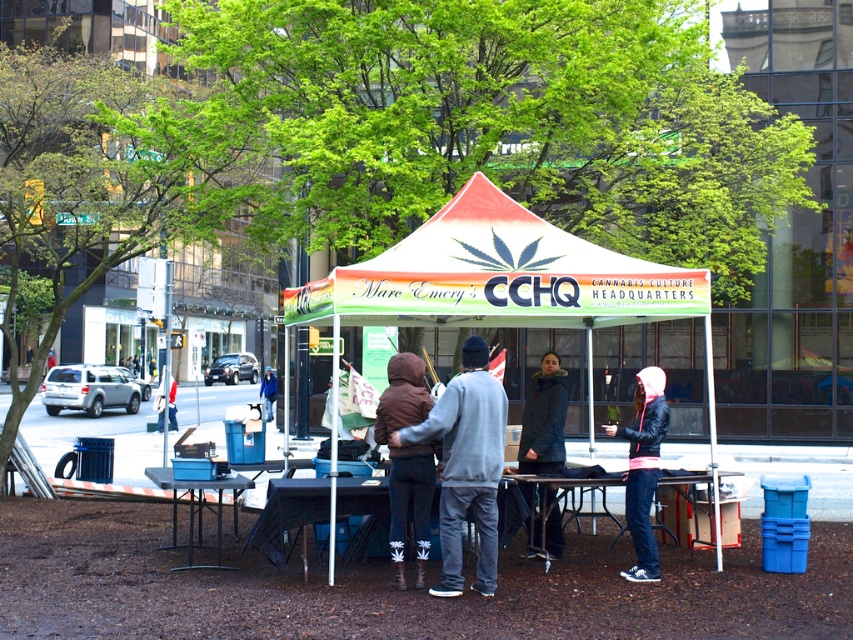
You are a delivery person who needs to place a small package between the matte gray hoodie at center and the brown fleece jacket at center. Can you fit the package in the space between them if the package is 12 inches long?

The space between the matte gray hoodie at center and the brown fleece jacket at center is 13.05 inches. Since the package is 12 inches long, it can fit in the space between them.

You are a person who wants to borrow a jacket from the people at the Cannabis Culture Headquarters event. You see a matte gray hoodie at center and a brown fleece jacket at center. Which one is bigger?

The matte gray hoodie at center is larger in size compared to the brown fleece jacket at center.